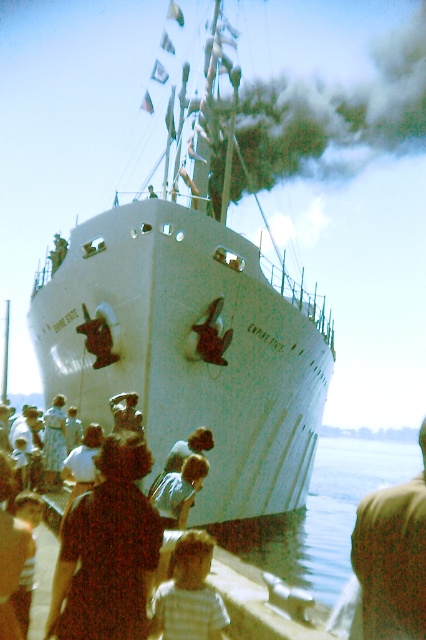
You are a photographer standing at the dockside event near the Empire State ship. You want to take a photo of the striped cotton shirt at lower center and the brown fabric at lower right. If your camera has a focal length of 50mm, which object should you focus on first to ensure both are in focus?

Since the brown fabric at lower right is 13.09 meters away from the striped cotton shirt at lower center, you should focus on the striped cotton shirt at lower center because it is closer to you, ensuring both objects will be in focus within the depth of field.

You are standing on the dock and looking at the Empire State ship. There are two points marked on the ship, one at coordinates point (x=388, y=577) and the other at point (x=226, y=612). Which of these two points is closer to you?

Point (x=388, y=577) is closer to the viewer than point (x=226, y=612).

You are standing at the center of the dock and want to place a small potted plant exactly where the brown fabric at lower right is located. What are the coordinates where you should place the plant?

The coordinates for the brown fabric at lower right are at point (393, 557). Place the plant at those coordinates.